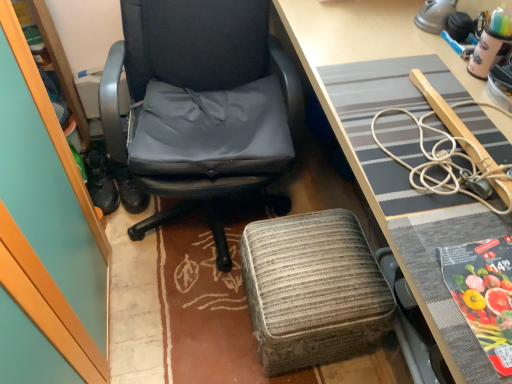
Question: Considering the relative sizes of textured gray desk mat at center and black rubber shoes at left in the image provided, is textured gray desk mat at center taller than black rubber shoes at left?

Choices:
 (A) no
 (B) yes

Answer: (B)

Question: Considering the relative positions of textured gray desk mat at center and black rubber shoes at left in the image provided, is textured gray desk mat at center to the left of black rubber shoes at left from the viewer's perspective?

Choices:
 (A) yes
 (B) no

Answer: (B)

Question: Is textured gray desk mat at center oriented away from black rubber shoes at left?

Choices:
 (A) yes
 (B) no

Answer: (B)

Question: Does textured gray desk mat at center come in front of black rubber shoes at left?

Choices:
 (A) yes
 (B) no

Answer: (A)

Question: Can you confirm if textured gray desk mat at center is thinner than black rubber shoes at left?

Choices:
 (A) yes
 (B) no

Answer: (B)

Question: Is matte black office chair at center wider or thinner than printed paper at lower right?

Choices:
 (A) wide
 (B) thin

Answer: (A)

Question: Is point (143, 203) closer or farther from the camera than point (466, 278)?

Choices:
 (A) closer
 (B) farther

Answer: (B)

Question: Is matte black office chair at center inside or outside of printed paper at lower right?

Choices:
 (A) outside
 (B) inside

Answer: (A)

Question: Looking at the image, does matte black office chair at center seem bigger or smaller compared to printed paper at lower right?

Choices:
 (A) small
 (B) big

Answer: (B)

Question: Relative to woven fabric stool at lower center, is black rubber shoes at left in front or behind?

Choices:
 (A) front
 (B) behind

Answer: (B)

Question: Is black rubber shoes at left inside the boundaries of woven fabric stool at lower center, or outside?

Choices:
 (A) outside
 (B) inside

Answer: (A)

Question: Considering the relative positions of black rubber shoes at left and woven fabric stool at lower center in the image provided, is black rubber shoes at left to the left or to the right of woven fabric stool at lower center?

Choices:
 (A) right
 (B) left

Answer: (B)

Question: Is black rubber shoes at left bigger or smaller than woven fabric stool at lower center?

Choices:
 (A) big
 (B) small

Answer: (B)

Question: Is woven fabric stool at lower center inside the boundaries of black rubber shoes at left, or outside?

Choices:
 (A) outside
 (B) inside

Answer: (A)

Question: Is woven fabric stool at lower center to the left or to the right of black rubber shoes at left in the image?

Choices:
 (A) left
 (B) right

Answer: (B)